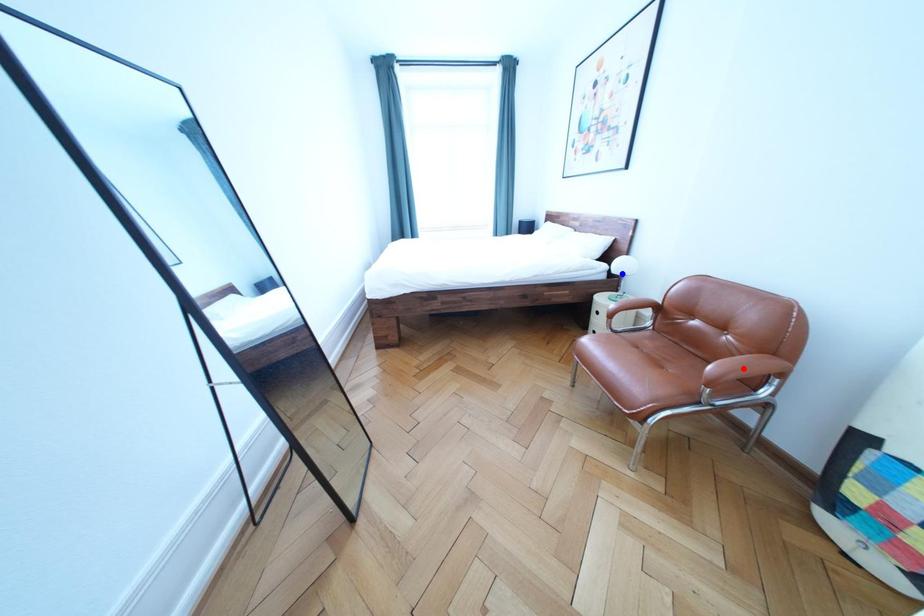
Question: Which of the two points in the image is closer to the camera?

Choices:
 (A) Blue point is closer.
 (B) Red point is closer.

Answer: (B)